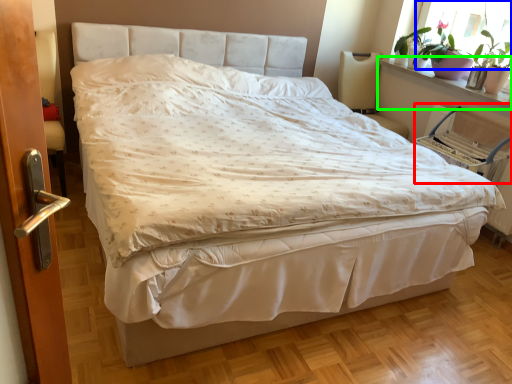
Question: Which is nearer to the armchair (highlighted by a red box)? window screen (highlighted by a blue box) or window sill (highlighted by a green box).

Choices:
 (A) window screen
 (B) window sill

Answer: (B)